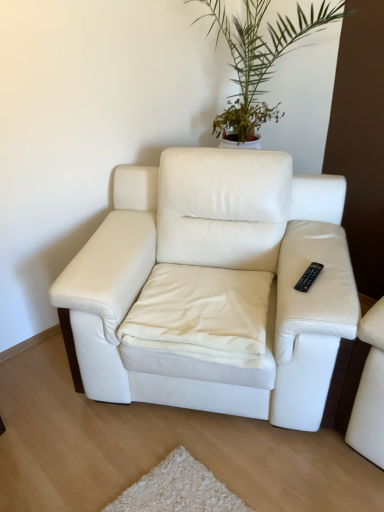
The image size is (384, 512). What are the coordinates of `white leather armchair at center` in the screenshot? It's located at (214, 288).

This screenshot has height=512, width=384. What do you see at coordinates (214, 288) in the screenshot?
I see `white leather armchair at center` at bounding box center [214, 288].

What is the approximate width of white leather armchair at center?

white leather armchair at center is 90.71 centimeters wide.

Where is `white leather armchair at center`? This screenshot has width=384, height=512. white leather armchair at center is located at coordinates (214, 288).